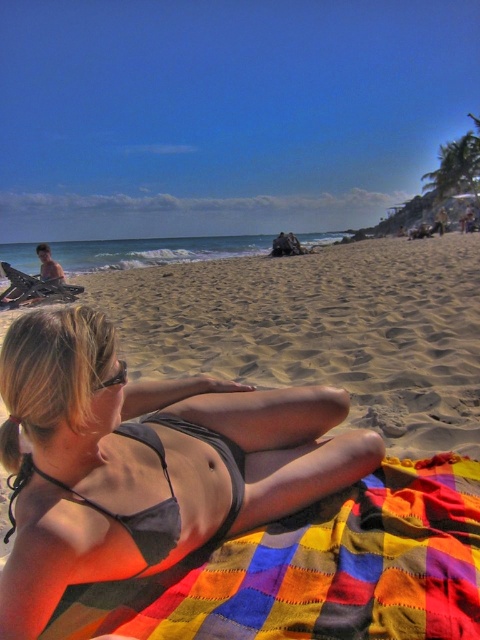
You are a photographer trying to capture the sandy yellow at center and the multicolored patchwork blanket at lower center in the same frame. Based on their positions, which object is closer to the camera?

The multicolored patchwork blanket at lower center is behind the sandy yellow at center, so the sandy yellow at center is closer to the camera.

You are a photographer standing at the edge of the beach. You see the point marked as point (144, 461) in the scene. What object does this point correspond to?

The point (144, 461) corresponds to the matte gray bikini at center.